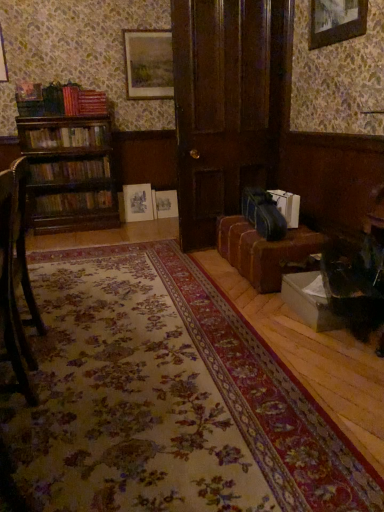
The image size is (384, 512). Identify the location of free space above hardcover book at left, which ranks as the third book in top-to-bottom order (from a real-world perspective). (80, 190).